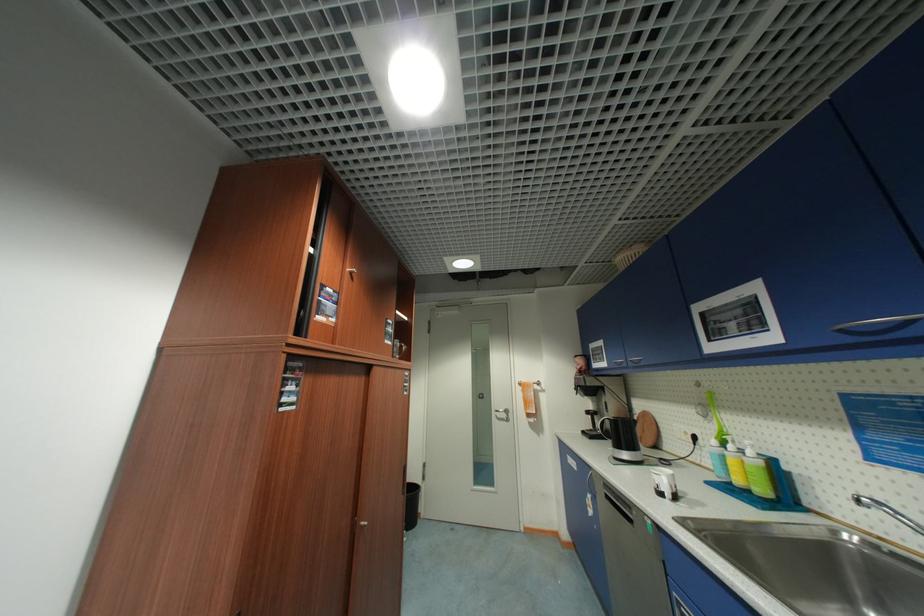
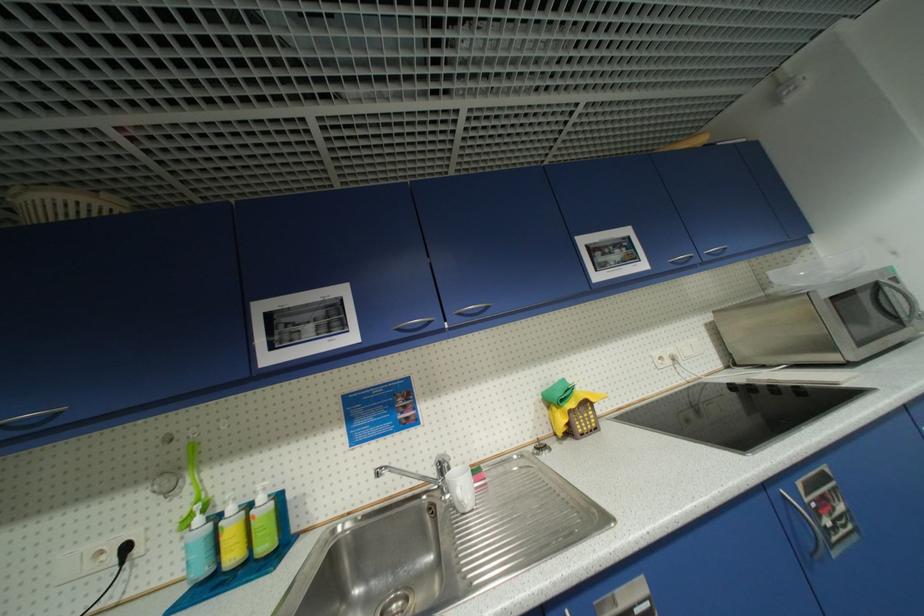
Find the pixel in the second image that matches [847,331] in the first image.

(405, 331)